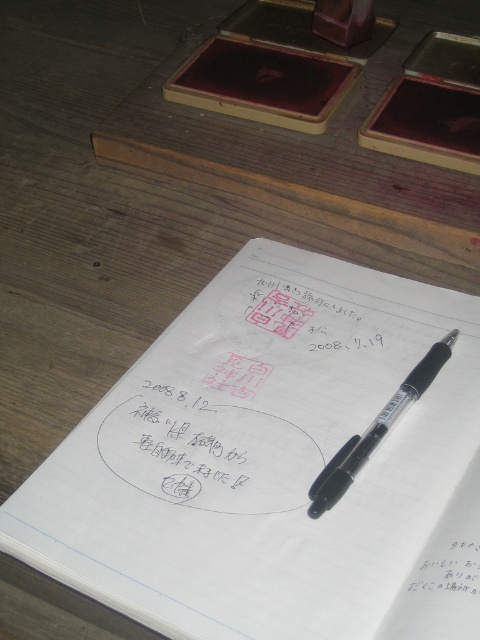
Question: Which object appears closest to the camera in this image?

Choices:
 (A) white paper notebook at center
 (B) white paper at lower right
 (C) transparent plastic pen at center

Answer: (A)

Question: Is white paper notebook at center wider than transparent plastic pen at center?

Choices:
 (A) yes
 (B) no

Answer: (A)

Question: Which of the following is the farthest from the observer?

Choices:
 (A) white paper at lower right
 (B) black ink writing at center
 (C) white paper notebook at center

Answer: (B)

Question: Can you confirm if transparent plastic pen at center is thinner than white paper at lower right?

Choices:
 (A) no
 (B) yes

Answer: (A)

Question: Which point is farther to the camera?

Choices:
 (A) (443, 554)
 (B) (195, 433)
 (C) (310, 486)

Answer: (B)

Question: Can you confirm if black ink writing at center is wider than transparent plastic pen at center?

Choices:
 (A) no
 (B) yes

Answer: (A)